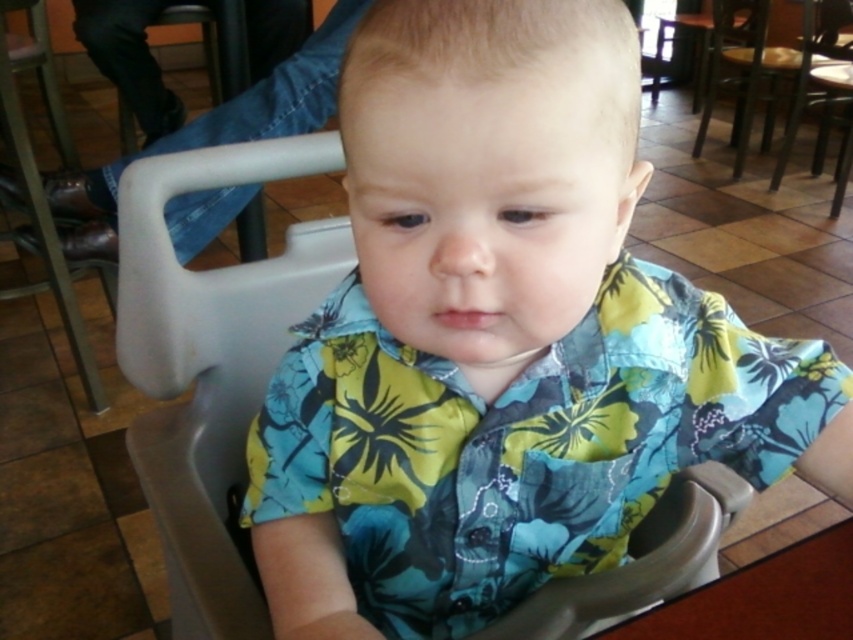
Does brown wooden table at lower right have a greater width compared to metallic gray chair at center?

Incorrect, brown wooden table at lower right's width does not surpass metallic gray chair at center's.

Does brown wooden table at lower right have a smaller size compared to metallic gray chair at center?

Indeed, brown wooden table at lower right has a smaller size compared to metallic gray chair at center.

The height and width of the screenshot is (640, 853). What do you see at coordinates (764, 596) in the screenshot?
I see `brown wooden table at lower right` at bounding box center [764, 596].

Find the location of a particular element. The width and height of the screenshot is (853, 640). brown wooden table at lower right is located at coordinates (764, 596).

Which of these two, brown wooden table at lower right or wooden chair at center, stands shorter?

With less height is brown wooden table at lower right.

Image resolution: width=853 pixels, height=640 pixels. Describe the element at coordinates (764, 596) in the screenshot. I see `brown wooden table at lower right` at that location.

This screenshot has height=640, width=853. Find the location of `brown wooden table at lower right`. brown wooden table at lower right is located at coordinates (764, 596).

Who is more forward, (x=519, y=634) or (x=717, y=84)?

Point (x=519, y=634) is more forward.

Measure the distance between gray plastic chair at center and camera.

A distance of 52.28 centimeters exists between gray plastic chair at center and camera.

This screenshot has width=853, height=640. What are the coordinates of `gray plastic chair at center` in the screenshot? It's located at (212, 364).